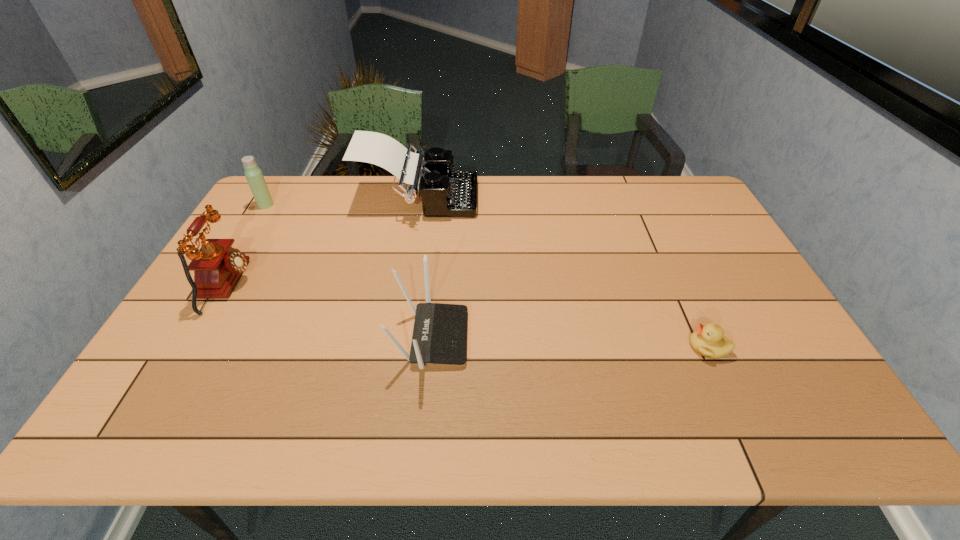
In order to click on typewriter in this screenshot , I will do `click(445, 193)`.

This screenshot has width=960, height=540. Identify the location of telephone. (217, 266).

I want to click on thermos bottle, so click(x=254, y=176).

Image resolution: width=960 pixels, height=540 pixels. Identify the location of router. (439, 336).

Image resolution: width=960 pixels, height=540 pixels. Find the location of `the shortest object`. the shortest object is located at coordinates (709, 341).

The height and width of the screenshot is (540, 960). In order to click on the rightmost object in this screenshot , I will do `click(709, 341)`.

You are a GUI agent. You are given a task and a screenshot of the screen. Output one action in this format:
    pyautogui.click(x=<x>, y=<y>)
    Task: Click on the vacant space positioned 0.070m on the keys of the typewriter
    This screenshot has height=540, width=960.
    Given the screenshot: What is the action you would take?
    pyautogui.click(x=497, y=199)

The width and height of the screenshot is (960, 540). I want to click on vacant space located 0.170m on the dial of the telephone, so click(x=309, y=286).

I want to click on vacant space located on the right of the thermos bottle, so click(369, 205).

This screenshot has height=540, width=960. I want to click on free space located 0.270m on the front-facing side of the router, so click(x=574, y=337).